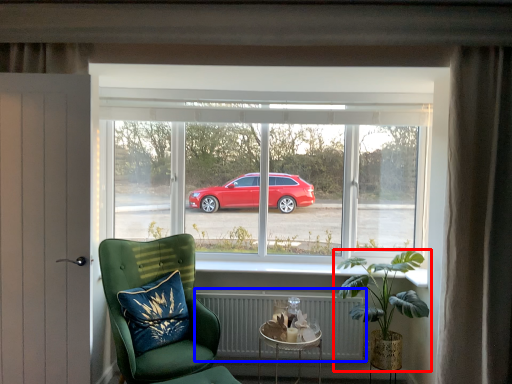
Question: Which object appears closest to the camera in this image, houseplant (highlighted by a red box) or radiator (highlighted by a blue box)?

Choices:
 (A) houseplant
 (B) radiator

Answer: (A)